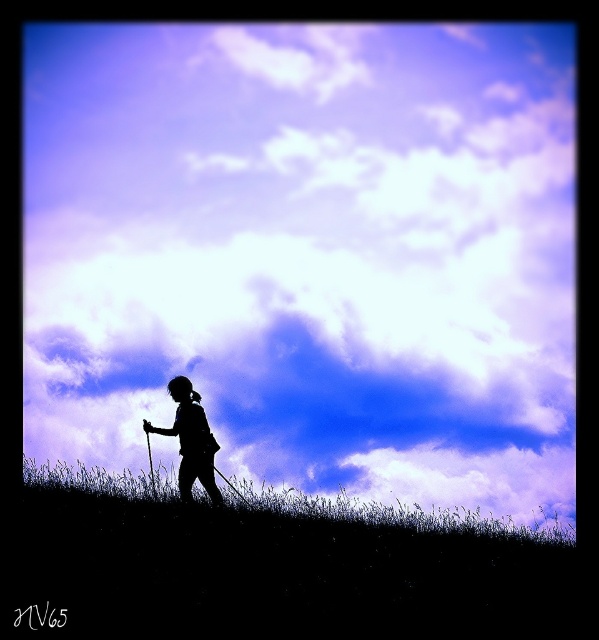
You are a hiker trying to navigate the path on the grassy hill. You see two points marked on the ground ahead of you. The first point is at coordinates point [123,593] and the second is at point [129,474]. Which point is closer to your current position?

Point [123,593] is in front of point [129,474], so it is closer to your current position.

You are a hiker trying to navigate to the exact center of the grassy hill in the image. The coordinates of the center are given as point (271, 572). Can you confirm if this point is indeed the center of the grassy hill?

The black grass at center is located at point (271, 572), so yes, this point is the exact center of the grassy hill.